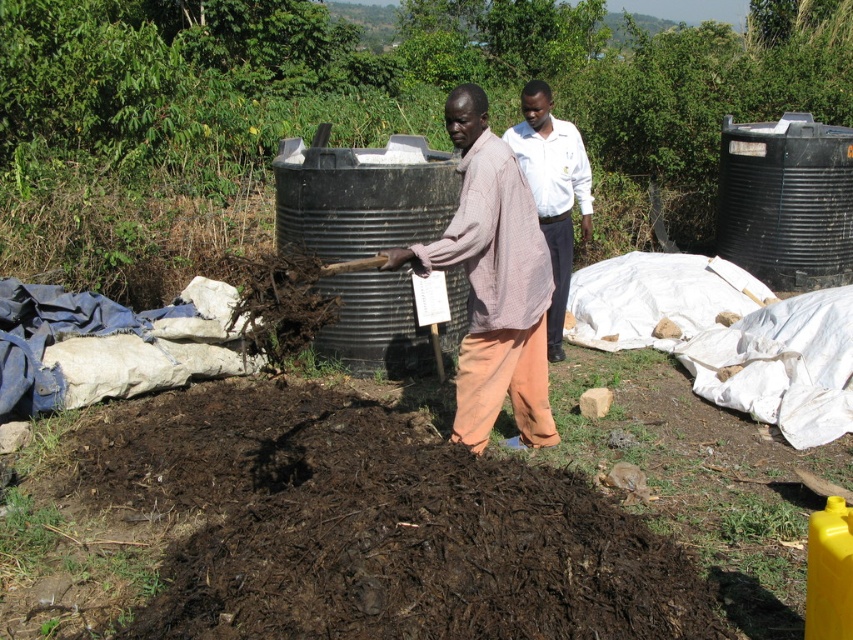
Does dark brown organic matter at center have a greater width compared to white shirt at center?

Indeed, dark brown organic matter at center has a greater width compared to white shirt at center.

Does dark brown organic matter at center appear on the left side of white shirt at center?

Correct, you'll find dark brown organic matter at center to the left of white shirt at center.

At what (x,y) coordinates should I click in order to perform the action: click on dark brown organic matter at center. Please return your answer as a coordinate pair (x, y). The width and height of the screenshot is (853, 640). Looking at the image, I should click on coord(338,529).

Is dark brown organic matter at center positioned at the back of light brown woven shirt at center?

No.

In the scene shown: Who is lower down, dark brown organic matter at center or light brown woven shirt at center?

dark brown organic matter at center

What do you see at coordinates (338, 529) in the screenshot?
I see `dark brown organic matter at center` at bounding box center [338, 529].

The height and width of the screenshot is (640, 853). Find the location of `dark brown organic matter at center`. dark brown organic matter at center is located at coordinates [338, 529].

Between light brown woven shirt at center and white shirt at center, which one has more height?

With more height is white shirt at center.

Does point (466, 444) lie in front of point (550, 170)?

Yes, point (466, 444) is closer to viewer.

This screenshot has width=853, height=640. What are the coordinates of `light brown woven shirt at center` in the screenshot? It's located at (492, 282).